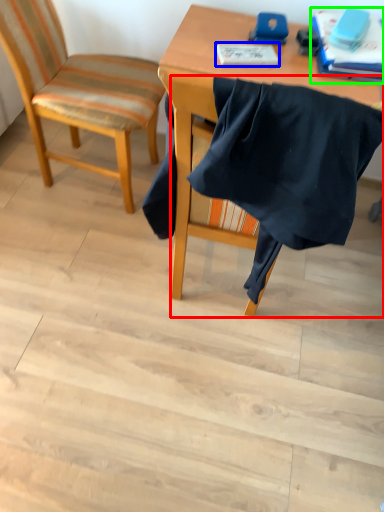
Question: Estimate the real-world distances between objects in this image. Which object is farther from chair (highlighted by a red box), notebook (highlighted by a blue box) or book (highlighted by a green box)?

Choices:
 (A) notebook
 (B) book

Answer: (B)